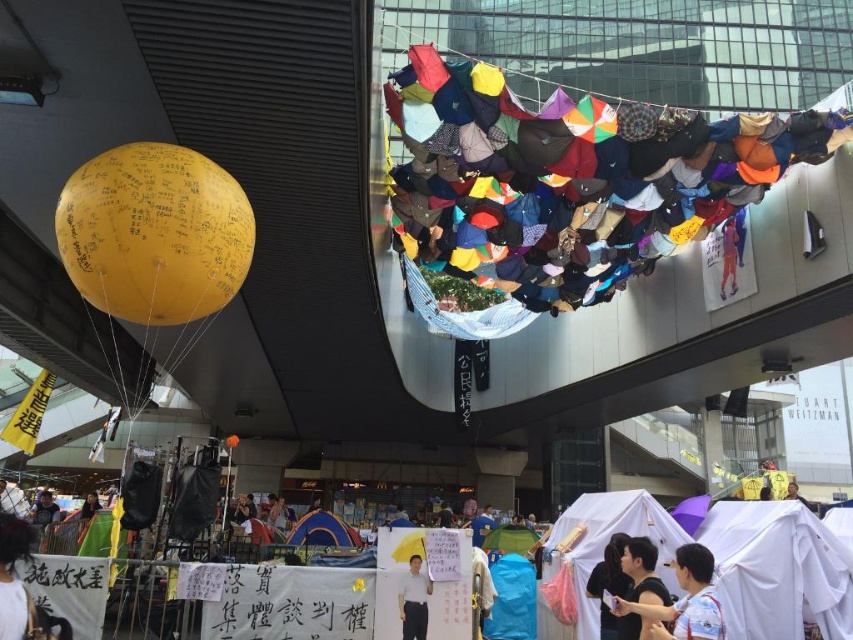
In the scene shown: You are a photographer trying to capture a closeup shot of the dark blue shirt at lower left and the light brown fabric at lower left. What is the minimum distance you need to maintain between the two objects to ensure both are in focus?

The dark blue shirt at lower left is 32.67 inches from the light brown fabric at lower left. To ensure both are in focus, the photographer should maintain at least 32.67 inches between the two objects.

You are a photographer standing at the edge of the protest area. You notice two items at the lower left corner of your viewfinder. One is the dark blue shirt at lower left and the other is the light brown fabric at lower left. Which one appears taller in the photo?

The light brown fabric at lower left appears taller because the dark blue shirt at lower left is shorter than it.